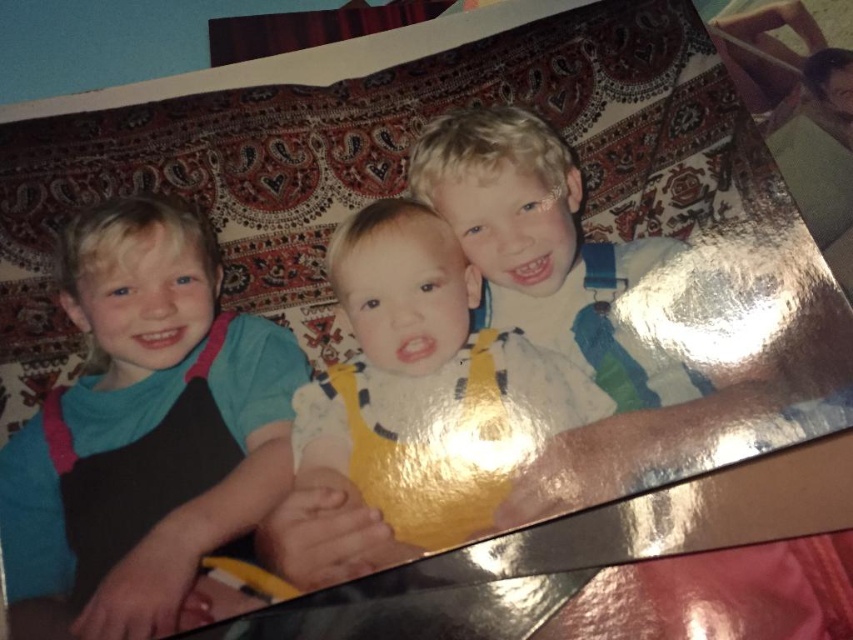
Question: Can you confirm if blue cotton shirt at left is positioned below matte blue overalls at center?

Choices:
 (A) no
 (B) yes

Answer: (B)

Question: Which point is closer to the camera?

Choices:
 (A) yellow fabric bib at center
 (B) matte blue overalls at center
 (C) blue cotton shirt at left

Answer: (C)

Question: Which point appears farthest from the camera in this image?

Choices:
 (A) (660, 404)
 (B) (412, 506)
 (C) (173, 433)

Answer: (A)

Question: Is yellow fabric bib at center further to the viewer compared to matte blue overalls at center?

Choices:
 (A) no
 (B) yes

Answer: (A)

Question: Which point is closer to the camera?

Choices:
 (A) yellow fabric bib at center
 (B) matte blue overalls at center
 (C) blue cotton shirt at left

Answer: (C)

Question: Can you confirm if blue cotton shirt at left is bigger than yellow fabric bib at center?

Choices:
 (A) yes
 (B) no

Answer: (A)